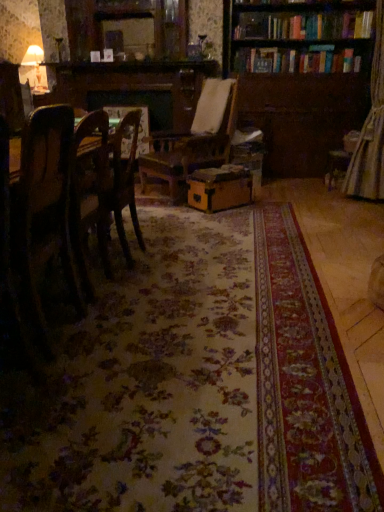
Question: Could wooden chair at left be considered to be inside matte brown cardboard box at center?

Choices:
 (A) no
 (B) yes

Answer: (A)

Question: Considering the relative sizes of matte brown cardboard box at center and wooden chair at left in the image provided, is matte brown cardboard box at center taller than wooden chair at left?

Choices:
 (A) no
 (B) yes

Answer: (A)

Question: Considering the relative sizes of matte brown cardboard box at center and wooden chair at left in the image provided, is matte brown cardboard box at center smaller than wooden chair at left?

Choices:
 (A) yes
 (B) no

Answer: (A)

Question: Is matte brown cardboard box at center next to wooden chair at left and touching it?

Choices:
 (A) no
 (B) yes

Answer: (A)

Question: Can you confirm if matte brown cardboard box at center is wider than wooden chair at left?

Choices:
 (A) yes
 (B) no

Answer: (A)

Question: Which is correct: wooden bookcase at upper right is inside matte brown cardboard box at center, or outside of it?

Choices:
 (A) inside
 (B) outside

Answer: (B)

Question: Considering the positions of wooden bookcase at upper right and matte brown cardboard box at center in the image, is wooden bookcase at upper right taller or shorter than matte brown cardboard box at center?

Choices:
 (A) short
 (B) tall

Answer: (B)

Question: Is wooden bookcase at upper right in front of or behind matte brown cardboard box at center in the image?

Choices:
 (A) front
 (B) behind

Answer: (B)

Question: From a real-world perspective, is wooden bookcase at upper right above or below matte brown cardboard box at center?

Choices:
 (A) below
 (B) above

Answer: (B)

Question: Considering the positions of matte brown cardboard box at center and wooden chair at left in the image, is matte brown cardboard box at center wider or thinner than wooden chair at left?

Choices:
 (A) wide
 (B) thin

Answer: (A)

Question: Is matte brown cardboard box at center to the left or to the right of wooden chair at left in the image?

Choices:
 (A) right
 (B) left

Answer: (A)

Question: Is matte brown cardboard box at center in front of or behind wooden chair at left in the image?

Choices:
 (A) behind
 (B) front

Answer: (A)

Question: From a real-world perspective, is matte brown cardboard box at center positioned above or below wooden chair at left?

Choices:
 (A) above
 (B) below

Answer: (B)

Question: Visually, is wooden bookcase at upper right positioned to the left or to the right of wooden chair at left?

Choices:
 (A) left
 (B) right

Answer: (B)

Question: Looking at the image, does wooden bookcase at upper right seem bigger or smaller compared to wooden chair at left?

Choices:
 (A) small
 (B) big

Answer: (B)